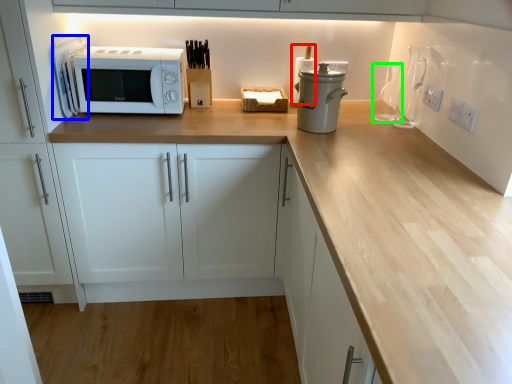
Question: Which object is positioned farthest from appliance (highlighted by a red box)? Select from appliance (highlighted by a blue box) and bottle (highlighted by a green box).

Choices:
 (A) appliance
 (B) bottle

Answer: (A)